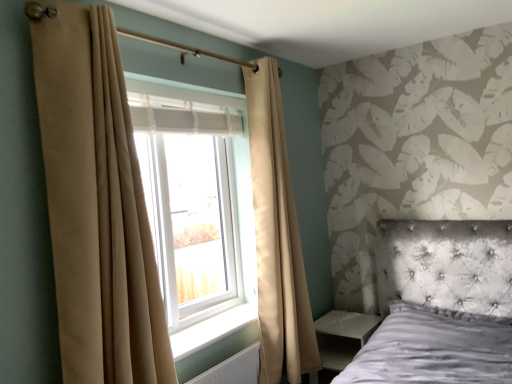
Measure the distance between beige fabric curtain at left, the first curtain when ordered from left to right, and camera.

beige fabric curtain at left, the first curtain when ordered from left to right, and camera are 1.46 meters apart from each other.

Where is `beige fabric curtain at left, arranged as the 1th curtain when viewed from the front`? beige fabric curtain at left, arranged as the 1th curtain when viewed from the front is located at coordinates (96, 202).

Measure the distance between point [300,358] and camera.

8.02 feet.

This screenshot has width=512, height=384. Find the location of `white plastic window at center`. white plastic window at center is located at coordinates (195, 202).

What is the approximate width of white smooth window sill at center?

white smooth window sill at center is 28.18 centimeters wide.

This screenshot has height=384, width=512. What do you see at coordinates (211, 330) in the screenshot?
I see `white smooth window sill at center` at bounding box center [211, 330].

Measure the distance between point (328, 352) and camera.

Point (328, 352) and camera are 8.97 feet apart.

Find the location of a particular element. white textured radiator at lower center is located at coordinates [x=234, y=369].

Where is `beige fabric curtain at left, which is counted as the second curtain, starting from the back`? Image resolution: width=512 pixels, height=384 pixels. beige fabric curtain at left, which is counted as the second curtain, starting from the back is located at coordinates (96, 202).

Does beige fabric curtain at left, which is the first curtain in back-to-front order, come in front of white plastic window at center?

No.

From the image's perspective, is beige fabric curtain at left, which is the first curtain from right to left, located beneath white plastic window at center?

Yes.

From a real-world perspective, is beige fabric curtain at left, which is the 2th curtain in front-to-back order, physically located above or below white plastic window at center?

beige fabric curtain at left, which is the 2th curtain in front-to-back order, is situated lower than white plastic window at center in the real world.

Is white plastic window at center outside of beige fabric curtain at left, which is counted as the second curtain, starting from the back?

Indeed, white plastic window at center is completely outside beige fabric curtain at left, which is counted as the second curtain, starting from the back.

From the image's perspective, does white plastic window at center appear higher than beige fabric curtain at left, acting as the 2th curtain starting from the right?

Actually, white plastic window at center appears below beige fabric curtain at left, acting as the 2th curtain starting from the right, in the image.

Considering the positions of points (225, 168) and (103, 81), is point (225, 168) farther from camera compared to point (103, 81)?

Yes, point (225, 168) is behind point (103, 81).

Which of these two, white plastic window at center or beige fabric curtain at left, which is counted as the second curtain, starting from the back, stands taller?

beige fabric curtain at left, which is counted as the second curtain, starting from the back.

From a real-world perspective, which is physically above, white plastic window at center or beige fabric curtain at left, which is the 2th curtain in front-to-back order?

From a 3D spatial view, white plastic window at center is above.

Is point (174, 164) farther from camera compared to point (278, 360)?

No, it is not.

Looking at this image, from the image's perspective, is white plastic window at center located above or below beige fabric curtain at left, which is the first curtain from right to left?

Based on their image positions, white plastic window at center is located above beige fabric curtain at left, which is the first curtain from right to left.

Considering the relative sizes of beige fabric curtain at left, which is counted as the second curtain, starting from the back, and white plastic window at center in the image provided, is beige fabric curtain at left, which is counted as the second curtain, starting from the back, taller than white plastic window at center?

Yes.

Which is in front, point (109, 85) or point (225, 241)?

The point (109, 85) is closer.

Looking at the image, does beige fabric curtain at left, the first curtain when ordered from left to right, seem bigger or smaller compared to white plastic window at center?

beige fabric curtain at left, the first curtain when ordered from left to right, is smaller than white plastic window at center.

Is white plastic window at center outside of white textured radiator at lower center?

Yes, white plastic window at center is not within white textured radiator at lower center.

Is white plastic window at center beside white textured radiator at lower center?

white plastic window at center and white textured radiator at lower center are not in contact.

Considering the positions of points (225, 109) and (240, 366), is point (225, 109) farther from camera compared to point (240, 366)?

Yes.

Is white smooth window sill at center looking in the opposite direction of white plastic window at center?

white smooth window sill at center does not have its back to white plastic window at center.

Is white smooth window sill at center positioned behind white plastic window at center?

No, white smooth window sill at center is closer to the camera.

From the image's perspective, which one is positioned higher, white smooth window sill at center or white plastic window at center?

white plastic window at center.

Looking at this image, is white smooth window sill at center inside or outside of white plastic window at center?

white smooth window sill at center is spatially situated outside white plastic window at center.

Considering the sizes of objects white glossy side table at lower right and beige fabric curtain at left, the first curtain when ordered from left to right, in the image provided, who is wider, white glossy side table at lower right or beige fabric curtain at left, the first curtain when ordered from left to right,?

white glossy side table at lower right is wider.

Considering the sizes of white glossy side table at lower right and beige fabric curtain at left, acting as the 2th curtain starting from the right, in the image, is white glossy side table at lower right taller or shorter than beige fabric curtain at left, acting as the 2th curtain starting from the right,?

white glossy side table at lower right is shorter than beige fabric curtain at left, acting as the 2th curtain starting from the right.

Is white glossy side table at lower right touching beige fabric curtain at left, arranged as the 1th curtain when viewed from the front?

No, white glossy side table at lower right is not touching beige fabric curtain at left, arranged as the 1th curtain when viewed from the front.

Looking at this image, would you say white glossy side table at lower right is inside or outside beige fabric curtain at left, the first curtain when ordered from left to right?

white glossy side table at lower right lies outside beige fabric curtain at left, the first curtain when ordered from left to right.

Identify the location of curtain on the right of white plastic window at center. The width and height of the screenshot is (512, 384). (277, 236).

In order to click on curtain located above the white plastic window at center (from the image's perspective) in this screenshot , I will do `click(96, 202)`.

From the picture: From the image, which object appears to be nearer to white textured radiator at lower center, white glossy side table at lower right or beige fabric curtain at left, arranged as the 1th curtain when viewed from the front?

Based on the image, white glossy side table at lower right appears to be nearer to white textured radiator at lower center.

Estimate the real-world distances between objects in this image. Which object is further from white glossy side table at lower right, white textured radiator at lower center or white smooth window sill at center?

white smooth window sill at center.

When comparing their distances from white smooth window sill at center, does beige fabric curtain at left, which is the first curtain from right to left, or beige fabric curtain at left, the first curtain when ordered from left to right, seem further?

beige fabric curtain at left, the first curtain when ordered from left to right, is positioned further to the anchor white smooth window sill at center.

Looking at the image, which one is located further to white plastic window at center, white smooth window sill at center or beige fabric curtain at left, which is counted as the second curtain, starting from the back?

beige fabric curtain at left, which is counted as the second curtain, starting from the back.

Which object lies further to the anchor point white plastic window at center, white textured radiator at lower center or white smooth window sill at center?

white textured radiator at lower center.

Based on their spatial positions, is white textured radiator at lower center or beige fabric curtain at left, arranged as the 1th curtain when viewed from the front, further from beige fabric curtain at left, which ranks as the second curtain in left-to-right order?

beige fabric curtain at left, arranged as the 1th curtain when viewed from the front, is positioned further to the anchor beige fabric curtain at left, which ranks as the second curtain in left-to-right order.

When comparing their distances from beige fabric curtain at left, arranged as the 1th curtain when viewed from the front, does white smooth window sill at center or white plastic window at center seem closer?

white plastic window at center is closer to beige fabric curtain at left, arranged as the 1th curtain when viewed from the front.

From the picture: Based on their spatial positions, is white plastic window at center or beige fabric curtain at left, the first curtain when ordered from left to right, closer to white glossy side table at lower right?

white plastic window at center is closer to white glossy side table at lower right.

The image size is (512, 384). What are the coordinates of `window sill that lies between white plastic window at center and white textured radiator at lower center from top to bottom` in the screenshot? It's located at (211, 330).

What are the coordinates of `curtain between beige fabric curtain at left, arranged as the 1th curtain when viewed from the front, and white glossy side table at lower right from front to back` in the screenshot? It's located at (277, 236).

In order to click on window sill located between beige fabric curtain at left, arranged as the 1th curtain when viewed from the front, and white plastic window at center in the depth direction in this screenshot , I will do `click(211, 330)`.

You are a GUI agent. You are given a task and a screenshot of the screen. Output one action in this format:
    pyautogui.click(x=<x>, y=<y>)
    Task: Click on the radiator that lies between beige fabric curtain at left, which is the first curtain from right to left, and white glossy side table at lower right from top to bottom
    This screenshot has width=512, height=384.
    Given the screenshot: What is the action you would take?
    pyautogui.click(x=234, y=369)